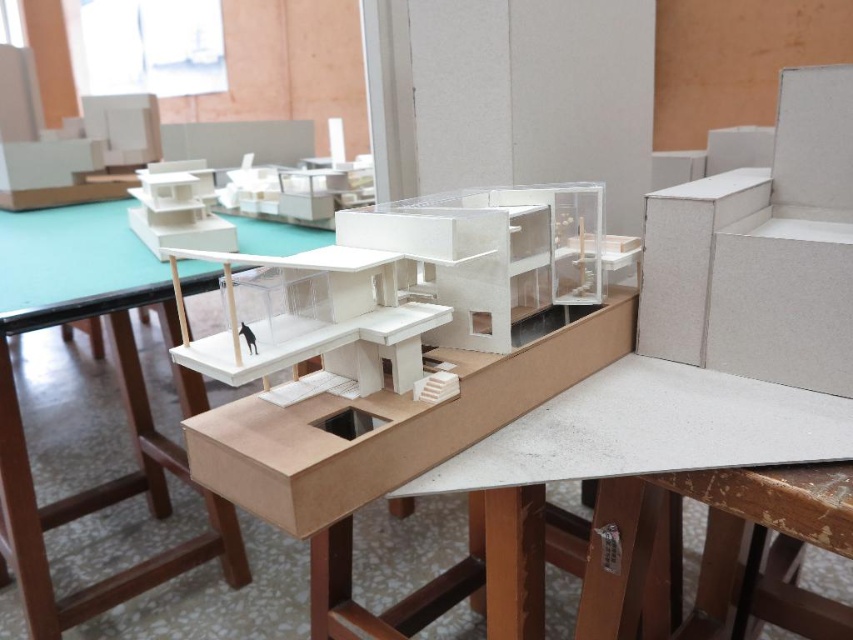
Can you confirm if white cardboard table at center is positioned above white matte dog at center?

Incorrect, white cardboard table at center is not positioned above white matte dog at center.

Can you confirm if white cardboard table at center is shorter than white matte dog at center?

No, white cardboard table at center is not shorter than white matte dog at center.

Between point (119, 573) and point (245, 340), which one is positioned in front?

Point (245, 340)

You are a GUI agent. You are given a task and a screenshot of the screen. Output one action in this format:
    pyautogui.click(x=<x>, y=<y>)
    Task: Click on the white cardboard table at center
    
    Given the screenshot: What is the action you would take?
    pyautogui.click(x=120, y=387)